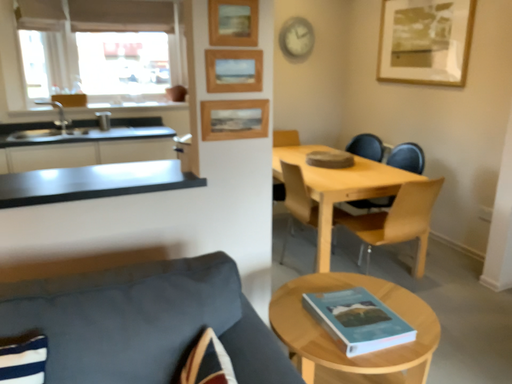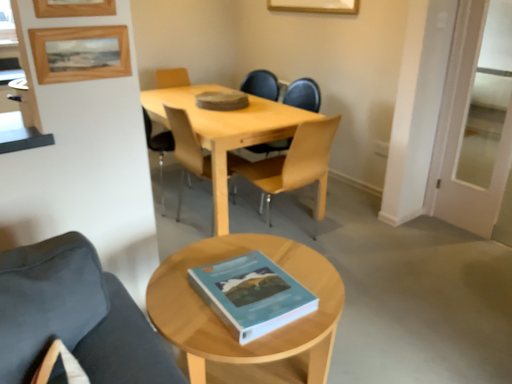
Question: How did the camera likely rotate when shooting the video?

Choices:
 (A) rotated right
 (B) rotated left

Answer: (A)